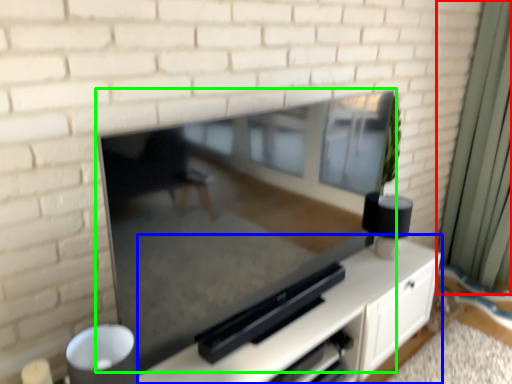
Question: Based on their relative distances, which object is farther from curtain (highlighted by a red box)? Choose from entertainment center (highlighted by a blue box) and fireplace (highlighted by a green box).

Choices:
 (A) entertainment center
 (B) fireplace

Answer: (B)